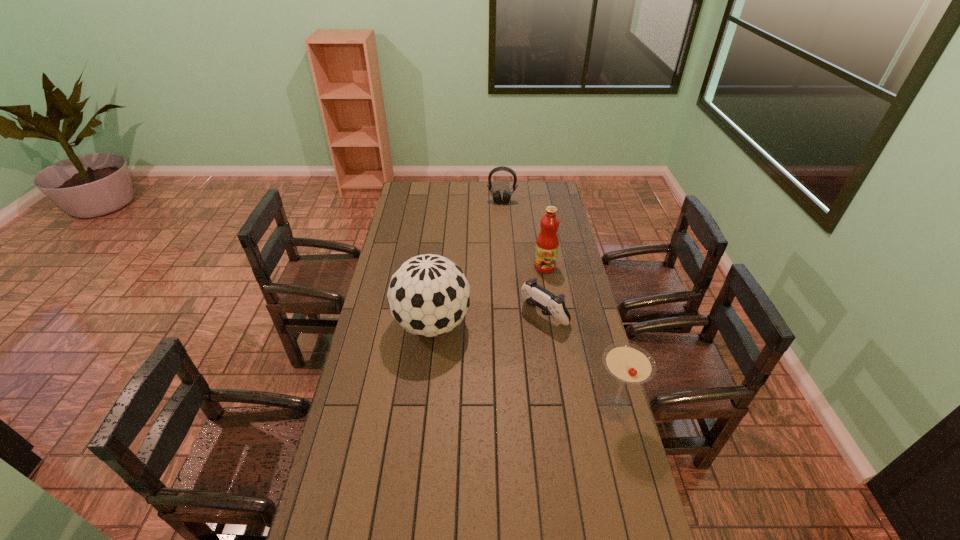
Find the location of a particular element. The width and height of the screenshot is (960, 540). blank region between the headset and the fourth nearest object is located at coordinates (523, 235).

You are a GUI agent. You are given a task and a screenshot of the screen. Output one action in this format:
    pyautogui.click(x=<x>, y=<y>)
    Task: Click on the vacant region between the second farthest object and the farthest object
    
    Given the screenshot: What is the action you would take?
    pyautogui.click(x=523, y=235)

The width and height of the screenshot is (960, 540). What are the coordinates of `free space between the rightmost object and the fruit juice` in the screenshot? It's located at (579, 338).

Identify the location of the fourth closest object relative to the fourth nearest object. This screenshot has height=540, width=960. (629, 363).

Point out which object is positioned as the second nearest to the control. Please provide its 2D coordinates. Your answer should be formatted as a tuple, i.e. [(x, y)], where the tuple contains the x and y coordinates of a point satisfying the conditions above.

[(428, 295)]

This screenshot has height=540, width=960. In order to click on free location that satisfies the following two spatial constraints: 1. on the front side of the fourth nearest object; 2. on the right side of the rightmost object in this screenshot , I will do `click(569, 408)`.

Image resolution: width=960 pixels, height=540 pixels. I want to click on free location that satisfies the following two spatial constraints: 1. on the front side of the second shortest object; 2. on the right side of the fruit juice, so click(506, 267).

Locate an element on the screen. vacant space that satisfies the following two spatial constraints: 1. on the front side of the third tallest object; 2. on the right side of the control is located at coordinates (558, 408).